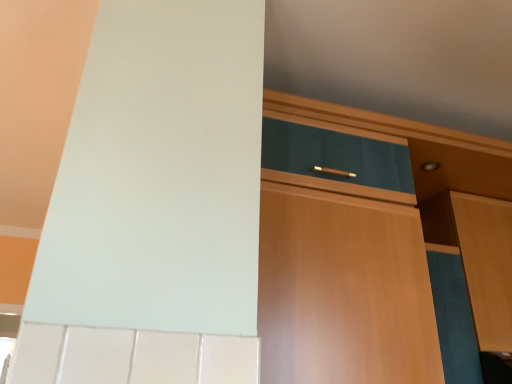
What is the approximate width of wooden cabinet at center, the second cabinetry viewed from the right?

The width of wooden cabinet at center, the second cabinetry viewed from the right, is 25.78 inches.

I want to click on wooden cabinet at center, the first cabinetry from the left, so click(416, 154).

What do you see at coordinates (416, 154) in the screenshot?
I see `wooden cabinet at center, the second cabinetry viewed from the right` at bounding box center [416, 154].

What is the approximate height of wooden cabinet at center, the first cabinetry from the left?

wooden cabinet at center, the first cabinetry from the left, is 79.69 centimeters in height.

What do you see at coordinates (486, 265) in the screenshot? This screenshot has height=384, width=512. I see `wooden cabinet at right, placed as the 1th cabinetry when sorted from right to left` at bounding box center [486, 265].

At what (x,y) coordinates should I click in order to perform the action: click on wooden cabinet at right, placed as the 1th cabinetry when sorted from right to left. Please return your answer as a coordinate pair (x, y). Image resolution: width=512 pixels, height=384 pixels. Looking at the image, I should click on (486, 265).

Find the location of a particular element. This screenshot has width=512, height=384. wooden cabinet at center, the second cabinetry viewed from the right is located at coordinates (416, 154).

Considering the positions of objects wooden cabinet at center, the second cabinetry viewed from the right, and wooden cabinet at right, placed as the 1th cabinetry when sorted from right to left, in the image provided, who is more to the right, wooden cabinet at center, the second cabinetry viewed from the right, or wooden cabinet at right, placed as the 1th cabinetry when sorted from right to left,?

Positioned to the right is wooden cabinet at right, placed as the 1th cabinetry when sorted from right to left.

Which object is closer to the camera taking this photo, wooden cabinet at center, the second cabinetry viewed from the right, or wooden cabinet at right, placed as the 1th cabinetry when sorted from right to left?

wooden cabinet at center, the second cabinetry viewed from the right.

Is point (322, 121) less distant than point (495, 276)?

Yes.

From the image's perspective, is wooden cabinet at center, the second cabinetry viewed from the right, located beneath wooden cabinet at right, placed as the 1th cabinetry when sorted from right to left?

No, from the image's perspective, wooden cabinet at center, the second cabinetry viewed from the right, is not below wooden cabinet at right, placed as the 1th cabinetry when sorted from right to left.

From a real-world perspective, is wooden cabinet at center, the first cabinetry from the left, above or below wooden cabinet at right, placed as the 1th cabinetry when sorted from right to left?

In terms of real-world spatial position, wooden cabinet at center, the first cabinetry from the left, is below wooden cabinet at right, placed as the 1th cabinetry when sorted from right to left.

Considering the relative sizes of wooden cabinet at center, the first cabinetry from the left, and wooden cabinet at right, arranged as the second cabinetry when viewed from the left, in the image provided, is wooden cabinet at center, the first cabinetry from the left, wider than wooden cabinet at right, arranged as the second cabinetry when viewed from the left,?

Indeed, wooden cabinet at center, the first cabinetry from the left, has a greater width compared to wooden cabinet at right, arranged as the second cabinetry when viewed from the left.

Does wooden cabinet at center, the first cabinetry from the left, have a lesser height compared to wooden cabinet at right, arranged as the second cabinetry when viewed from the left?

In fact, wooden cabinet at center, the first cabinetry from the left, may be taller than wooden cabinet at right, arranged as the second cabinetry when viewed from the left.

Who is bigger, wooden cabinet at center, the second cabinetry viewed from the right, or wooden cabinet at right, placed as the 1th cabinetry when sorted from right to left?

wooden cabinet at center, the second cabinetry viewed from the right, is bigger.

Is wooden cabinet at center, the first cabinetry from the left, not within wooden cabinet at right, placed as the 1th cabinetry when sorted from right to left?

Indeed, wooden cabinet at center, the first cabinetry from the left, is completely outside wooden cabinet at right, placed as the 1th cabinetry when sorted from right to left.

Are wooden cabinet at center, the second cabinetry viewed from the right, and wooden cabinet at right, arranged as the second cabinetry when viewed from the left, far apart?

No, there isn't a large distance between wooden cabinet at center, the second cabinetry viewed from the right, and wooden cabinet at right, arranged as the second cabinetry when viewed from the left.

Is wooden cabinet at center, the second cabinetry viewed from the right, turned away from wooden cabinet at right, placed as the 1th cabinetry when sorted from right to left?

wooden cabinet at center, the second cabinetry viewed from the right, does not have its back to wooden cabinet at right, placed as the 1th cabinetry when sorted from right to left.

You are a GUI agent. You are given a task and a screenshot of the screen. Output one action in this format:
    pyautogui.click(x=<x>, y=<y>)
    Task: Click on the cabinetry behind the wooden cabinet at center, the first cabinetry from the left
    The width and height of the screenshot is (512, 384).
    Given the screenshot: What is the action you would take?
    pyautogui.click(x=486, y=265)

Is wooden cabinet at right, arranged as the second cabinetry when viewed from the left, to the left or to the right of wooden cabinet at center, the first cabinetry from the left, in the image?

Clearly, wooden cabinet at right, arranged as the second cabinetry when viewed from the left, is on the right of wooden cabinet at center, the first cabinetry from the left, in the image.

Between wooden cabinet at right, arranged as the second cabinetry when viewed from the left, and wooden cabinet at center, the second cabinetry viewed from the right, which one is positioned in front?

wooden cabinet at center, the second cabinetry viewed from the right.

Does point (504, 267) lie behind point (357, 126)?

Yes, point (504, 267) is farther from viewer.

Based on the photo, from the image's perspective, between wooden cabinet at right, placed as the 1th cabinetry when sorted from right to left, and wooden cabinet at center, the first cabinetry from the left, which one is located above?

wooden cabinet at center, the first cabinetry from the left, is shown above in the image.

From a real-world perspective, which object rests below the other?

In real-world perspective, wooden cabinet at center, the second cabinetry viewed from the right, is lower.

Looking at their sizes, would you say wooden cabinet at right, placed as the 1th cabinetry when sorted from right to left, is wider or thinner than wooden cabinet at center, the first cabinetry from the left?

Considering their sizes, wooden cabinet at right, placed as the 1th cabinetry when sorted from right to left, looks slimmer than wooden cabinet at center, the first cabinetry from the left.

Can you confirm if wooden cabinet at right, arranged as the second cabinetry when viewed from the left, is taller than wooden cabinet at center, the first cabinetry from the left?

No.

Considering the relative sizes of wooden cabinet at right, arranged as the second cabinetry when viewed from the left, and wooden cabinet at center, the first cabinetry from the left, in the image provided, is wooden cabinet at right, arranged as the second cabinetry when viewed from the left, smaller than wooden cabinet at center, the first cabinetry from the left,?

Correct, wooden cabinet at right, arranged as the second cabinetry when viewed from the left, occupies less space than wooden cabinet at center, the first cabinetry from the left.

Which is correct: wooden cabinet at right, placed as the 1th cabinetry when sorted from right to left, is inside wooden cabinet at center, the second cabinetry viewed from the right, or outside of it?

wooden cabinet at right, placed as the 1th cabinetry when sorted from right to left, is spatially situated outside wooden cabinet at center, the second cabinetry viewed from the right.

Is wooden cabinet at right, arranged as the second cabinetry when viewed from the left, next to wooden cabinet at center, the first cabinetry from the left, and touching it?

No, wooden cabinet at right, arranged as the second cabinetry when viewed from the left, is not with wooden cabinet at center, the first cabinetry from the left.

Is wooden cabinet at right, placed as the 1th cabinetry when sorted from right to left, facing away from wooden cabinet at center, the first cabinetry from the left?

No, wooden cabinet at right, placed as the 1th cabinetry when sorted from right to left,'s orientation is not away from wooden cabinet at center, the first cabinetry from the left.

Can you tell me how much wooden cabinet at right, placed as the 1th cabinetry when sorted from right to left, and wooden cabinet at center, the first cabinetry from the left, differ in facing direction?

0.542 degrees separate the facing orientations of wooden cabinet at right, placed as the 1th cabinetry when sorted from right to left, and wooden cabinet at center, the first cabinetry from the left.

Locate an element on the screen. cabinetry below the wooden cabinet at right, placed as the 1th cabinetry when sorted from right to left (from a real-world perspective) is located at coordinates (416, 154).

The width and height of the screenshot is (512, 384). I want to click on cabinetry located on the left of wooden cabinet at right, arranged as the second cabinetry when viewed from the left, so click(416, 154).

Locate an element on the screen. cabinetry that appears in front of the wooden cabinet at right, placed as the 1th cabinetry when sorted from right to left is located at coordinates 416,154.